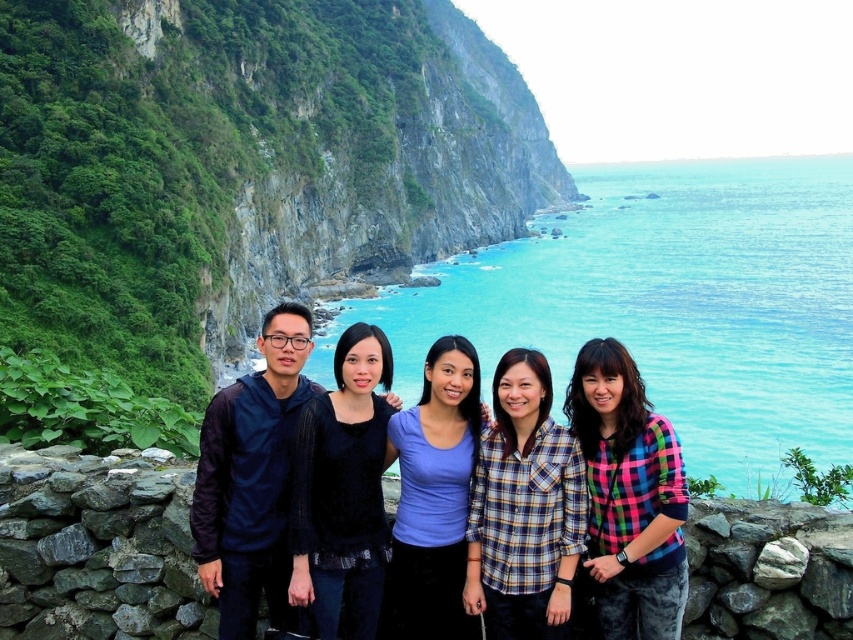
Question: Does green rock cliff at upper left have a lesser width compared to turquoise water at center?

Choices:
 (A) no
 (B) yes

Answer: (B)

Question: Which object is positioned closest to the matte black jacket at center?

Choices:
 (A) turquoise water at center
 (B) green rock cliff at upper left

Answer: (B)

Question: Which object is closer to the camera taking this photo?

Choices:
 (A) matte black jacket at center
 (B) turquoise water at center

Answer: (A)

Question: Can you confirm if turquoise water at center is thinner than matte black jacket at center?

Choices:
 (A) yes
 (B) no

Answer: (B)

Question: Considering the real-world distances, which object is farthest from the matte black jacket at center?

Choices:
 (A) green rock cliff at upper left
 (B) turquoise water at center

Answer: (B)

Question: Is turquoise water at center wider than matte black jacket at center?

Choices:
 (A) yes
 (B) no

Answer: (A)